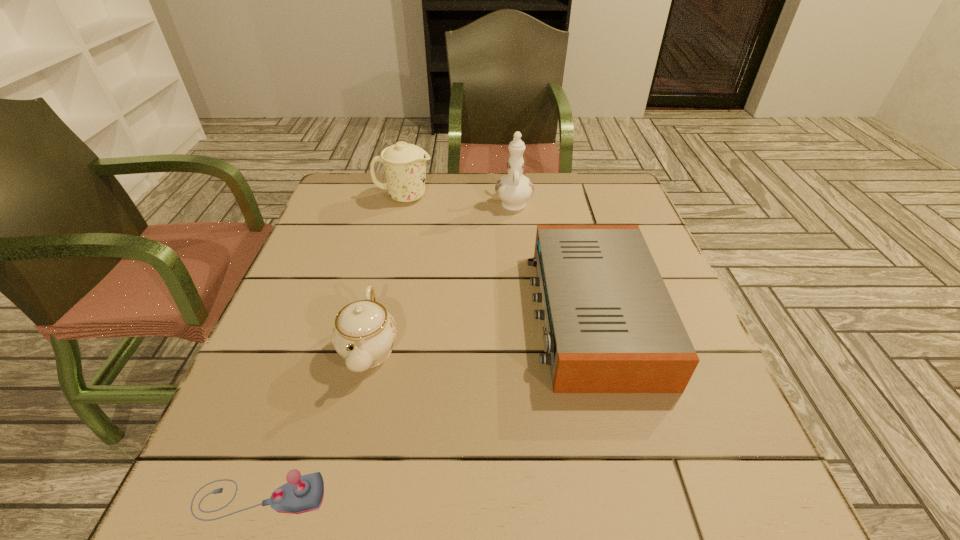
Where is `vacant space located on the front panel of the radio receiver`? vacant space located on the front panel of the radio receiver is located at coordinates (443, 314).

This screenshot has height=540, width=960. I want to click on vacant space positioned on the front panel of the radio receiver, so click(385, 314).

This screenshot has height=540, width=960. In order to click on free region located on the front panel of the radio receiver in this screenshot , I will do `click(375, 314)`.

The width and height of the screenshot is (960, 540). I want to click on vacant area situated on the back of the nearest object, so click(x=322, y=325).

Locate an element on the screen. The image size is (960, 540). object positioned at the near edge is located at coordinates (305, 493).

At what (x,y) coordinates should I click in order to perform the action: click on joystick that is at the left edge. Please return your answer as a coordinate pair (x, y). Looking at the image, I should click on (305, 493).

Where is `object that is at the right edge`? object that is at the right edge is located at coordinates pyautogui.click(x=610, y=324).

Identify the location of object present at the far left corner. The image size is (960, 540). (405, 164).

Image resolution: width=960 pixels, height=540 pixels. I want to click on object located in the near left corner section of the desktop, so click(x=305, y=493).

Where is `free space at the far edge of the desktop`? This screenshot has width=960, height=540. free space at the far edge of the desktop is located at coordinates (539, 194).